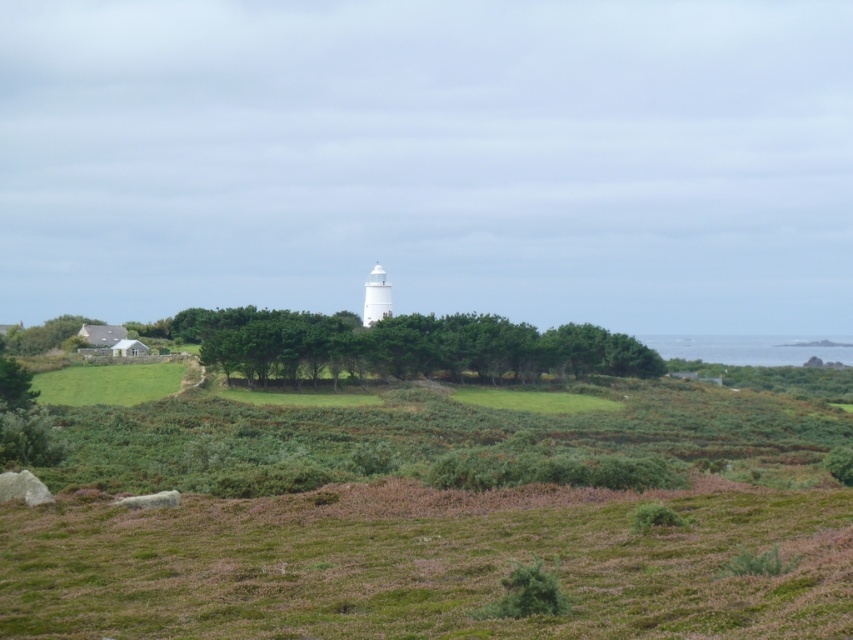
Can you confirm if green grassy field at lower left is wider than green leafy tree at lower left?

Incorrect, green grassy field at lower left's width does not surpass green leafy tree at lower left's.

This screenshot has height=640, width=853. Describe the element at coordinates (108, 384) in the screenshot. I see `green grassy field at lower left` at that location.

You are a GUI agent. You are given a task and a screenshot of the screen. Output one action in this format:
    pyautogui.click(x=<x>, y=<y>)
    Task: Click on the green grassy field at lower left
    The width and height of the screenshot is (853, 640).
    Given the screenshot: What is the action you would take?
    pyautogui.click(x=108, y=384)

The image size is (853, 640). What do you see at coordinates (404, 346) in the screenshot? I see `green leafy trees at center` at bounding box center [404, 346].

Can you confirm if green leafy trees at center is positioned to the right of green grassy field at lower left?

Yes, green leafy trees at center is to the right of green grassy field at lower left.

Is point (412, 332) positioned behind point (170, 387)?

Yes, point (412, 332) is behind point (170, 387).

The height and width of the screenshot is (640, 853). I want to click on green leafy trees at center, so click(x=404, y=346).

Who is more distant from viewer, (x=404, y=376) or (x=25, y=353)?

Point (x=25, y=353)

Measure the distance between point (622,356) and camera.

The distance of point (622,356) from camera is 208.19 meters.

This screenshot has width=853, height=640. Identify the location of green leafy trees at center. (404, 346).